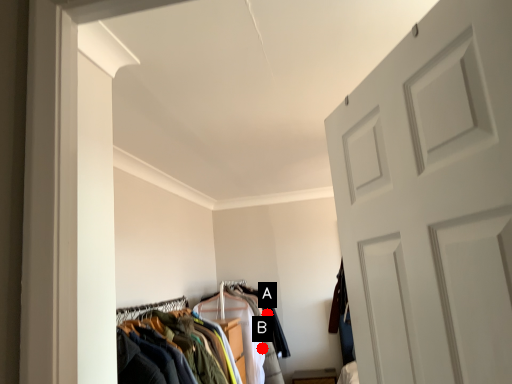
Question: Two points are circled on the image, labeled by A and B beside each circle. Which point is farther from the camera taking this photo?

Choices:
 (A) A is further
 (B) B is further

Answer: (A)